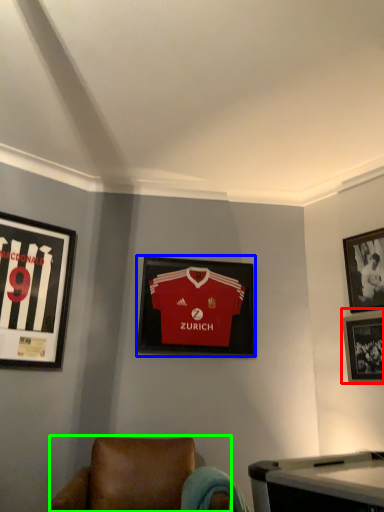
Question: Considering the real-world distances, which object is closest to picture frame (highlighted by a red box)? picture frame (highlighted by a blue box) or chair (highlighted by a green box).

Choices:
 (A) picture frame
 (B) chair

Answer: (A)